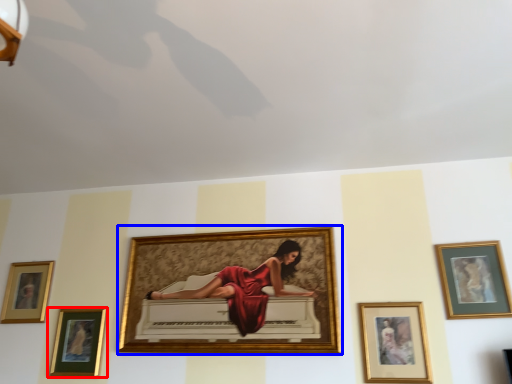
Question: Among these objects, which one is nearest to the camera, picture frame (highlighted by a red box) or picture frame (highlighted by a blue box)?

Choices:
 (A) picture frame
 (B) picture frame

Answer: (B)